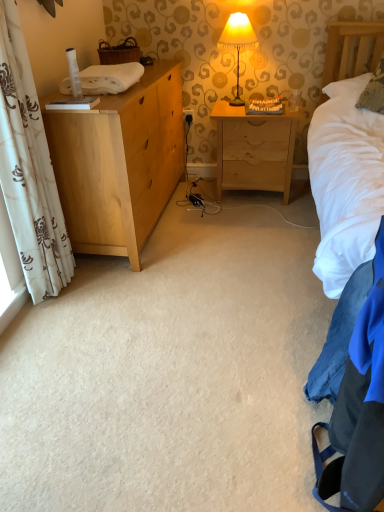
Question: Is yellow fabric lampshade at upper center in front of or behind white soft towel at left in the image?

Choices:
 (A) front
 (B) behind

Answer: (B)

Question: From a real-world perspective, is yellow fabric lampshade at upper center above or below white soft towel at left?

Choices:
 (A) below
 (B) above

Answer: (A)

Question: Estimate the real-world distances between objects in this image. Which object is farther from the textured beige pillow at upper right?

Choices:
 (A) white soft towel at left
 (B) yellow fabric lampshade at upper center
 (C) light wood nightstand at center
 (D) white floral fabric curtain at left
 (E) light wood chest of drawers at left

Answer: (D)

Question: Estimate the real-world distances between objects in this image. Which object is farther from the light wood nightstand at center?

Choices:
 (A) yellow fabric lampshade at upper center
 (B) white soft towel at left
 (C) textured beige pillow at upper right
 (D) white floral fabric curtain at left
 (E) light wood chest of drawers at left

Answer: (D)